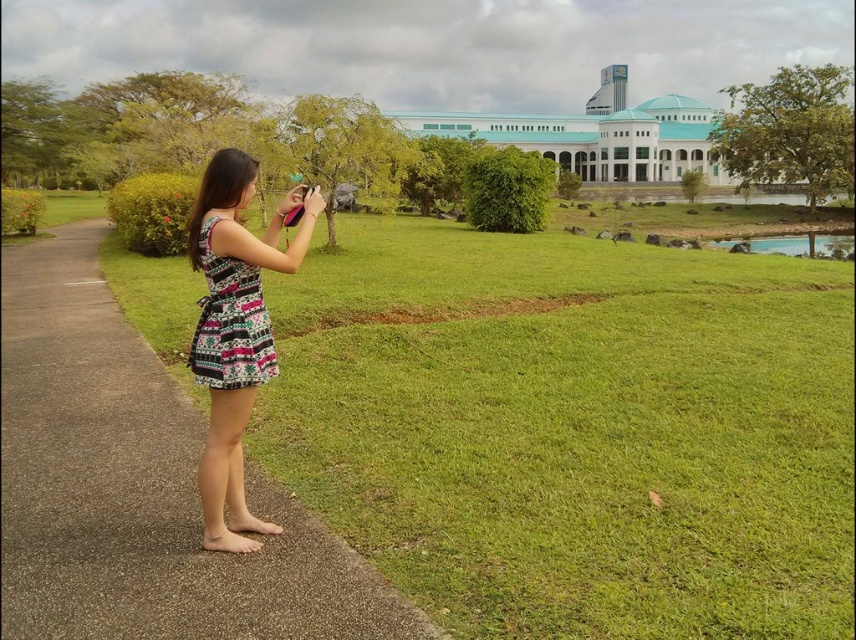
You are a photographer standing 2 meters away from the patterned fabric dress at center. You want to take a photo of it using a camera with a focal length of 50mm. The recommended distance for this camera setting is between 2.5 to 4 meters. Should you move closer or farther away to ensure the subject fills the frame properly?

You should move farther away because the recommended distance is between 2.5 to 4 meters, and you are currently 2 meters away, which is too close. Moving to 3.33 meters would place you within the recommended range, ensuring proper framing.

You are a photographer setting up a shot of the woman in the scene. The pavement at left and the printed fabric dress at center are in your frame. Which object is higher in the image?

The pavement at left is taller than the printed fabric dress at center, so the pavement at left appears higher in the image.